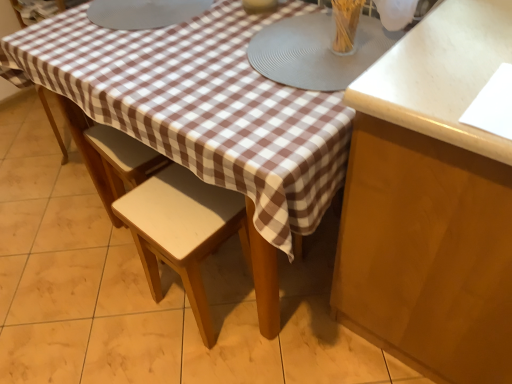
The image size is (512, 384). Identify the location of vacant space behind clear glass vase at upper center. (313, 26).